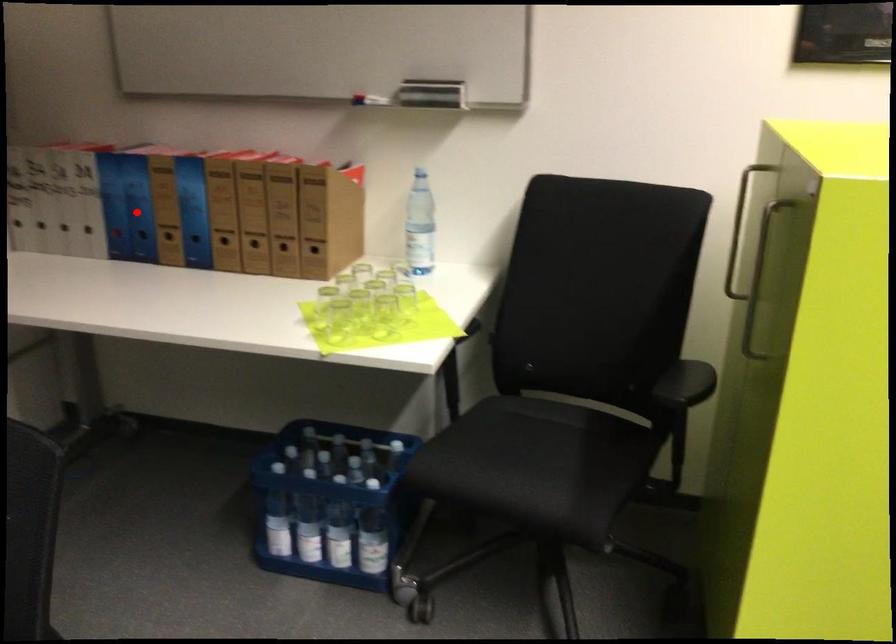
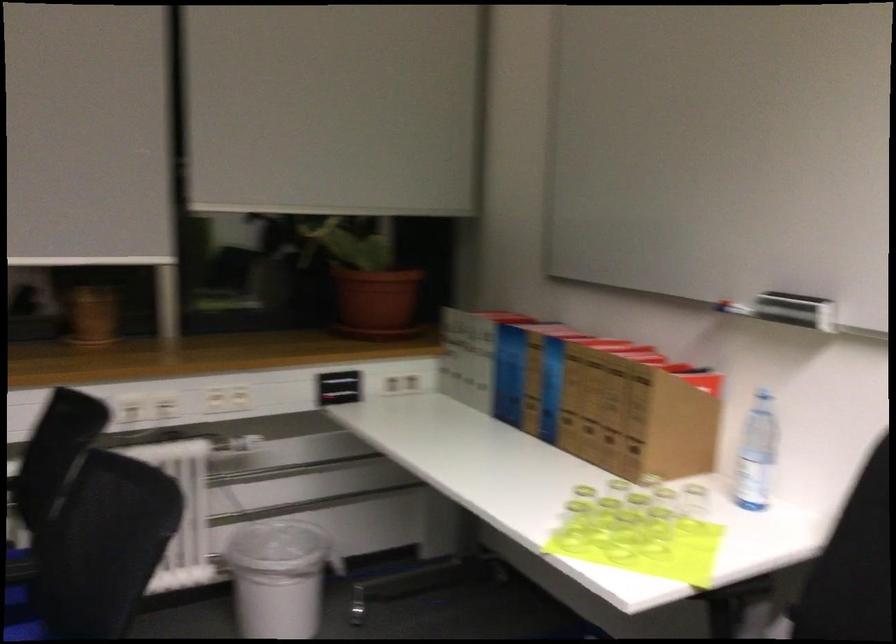
In the second image, find the point that corresponds to the highlighted location in the first image.

(509, 374)